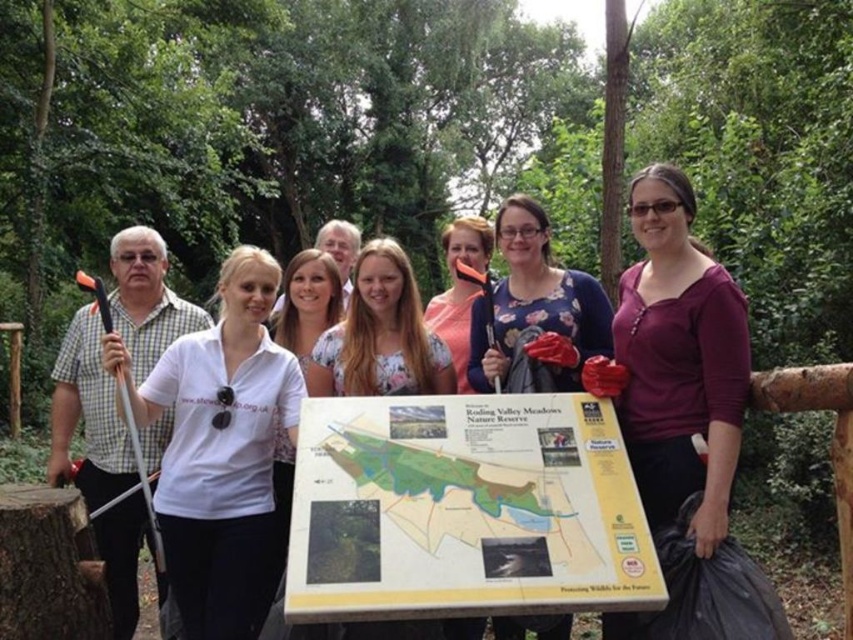
Question: Which object is closer to the camera taking this photo?

Choices:
 (A) floral fabric shirt at center
 (B) matte blue shirt at center

Answer: (B)

Question: Is matte blue shirt at center behind blonde hair at center?

Choices:
 (A) yes
 (B) no

Answer: (B)

Question: Which point is farther to the camera?

Choices:
 (A) (144, 524)
 (B) (405, 324)
 (C) (102, 339)

Answer: (A)

Question: In this image, where is matte black axe at left located relative to floral fabric shirt at center?

Choices:
 (A) left
 (B) right

Answer: (A)

Question: Based on their relative distances, which object is nearer to the white cotton shirt at center?

Choices:
 (A) floral fabric blouse at center
 (B) yellow matte board at center

Answer: (B)

Question: Is yellow matte board at center closer to the viewer compared to purple matte shirt at center?

Choices:
 (A) yes
 (B) no

Answer: (A)